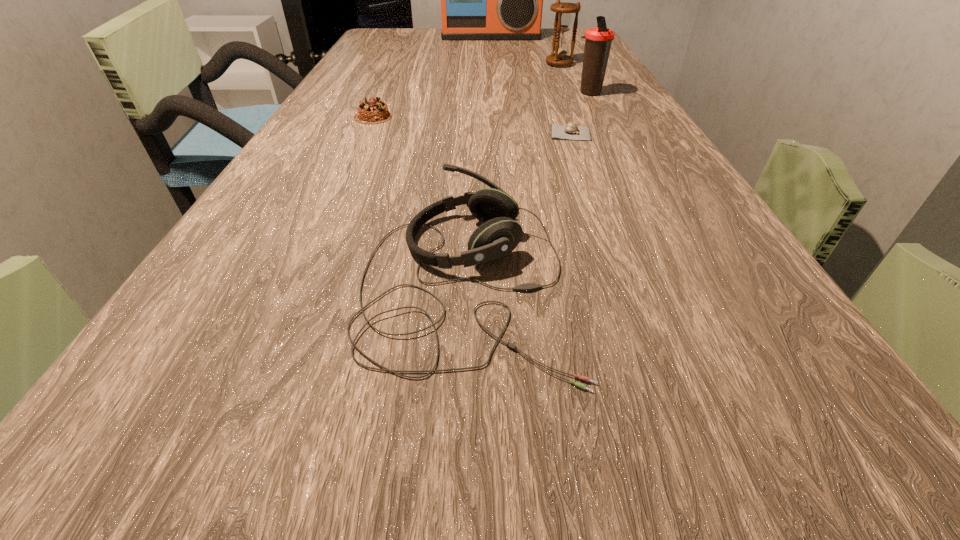
The width and height of the screenshot is (960, 540). I want to click on hourglass that is at the right edge, so [x=563, y=18].

The width and height of the screenshot is (960, 540). What are the coordinates of `garlic at the right edge` in the screenshot? It's located at (571, 131).

Where is `object at the far right corner`? object at the far right corner is located at coordinates (480, 0).

In the image, there is a desktop. Where is `vacant space at the left edge`? vacant space at the left edge is located at coordinates (130, 429).

You are a GUI agent. You are given a task and a screenshot of the screen. Output one action in this format:
    pyautogui.click(x=<x>, y=<y>)
    Task: Click on the vacant space at the right edge
    This screenshot has width=960, height=540.
    Given the screenshot: What is the action you would take?
    611,187

Where is `free region at the far left corner`? free region at the far left corner is located at coordinates (381, 46).

This screenshot has width=960, height=540. In order to click on blank space at the far right corner of the desktop in this screenshot , I will do [x=580, y=28].

At what (x,y) coordinates should I click in order to perform the action: click on vacant space at the near right corner. Please return your answer as a coordinate pair (x, y). The width and height of the screenshot is (960, 540). Looking at the image, I should click on (876, 501).

I want to click on vacant point located between the thermos bottle and the shortest object, so click(580, 113).

Locate an element on the screen. This screenshot has height=540, width=960. unoccupied area between the garlic and the thermos bottle is located at coordinates (580, 113).